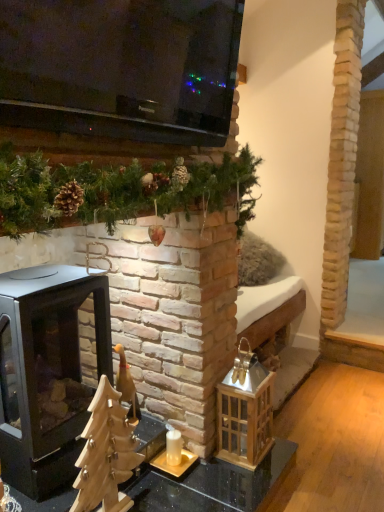
Question: Should I look upward or downward to see gold metallic candle holder at center?

Choices:
 (A) up
 (B) down

Answer: (B)

Question: Can you confirm if gold metallic candle holder at center is shorter than black matte wood burning stove at left?

Choices:
 (A) yes
 (B) no

Answer: (A)

Question: From a real-world perspective, is gold metallic candle holder at center positioned under black matte wood burning stove at left based on gravity?

Choices:
 (A) no
 (B) yes

Answer: (B)

Question: From the image's perspective, is gold metallic candle holder at center on top of black matte wood burning stove at left?

Choices:
 (A) no
 (B) yes

Answer: (A)

Question: Does gold metallic candle holder at center appear on the right side of black matte wood burning stove at left?

Choices:
 (A) yes
 (B) no

Answer: (A)

Question: Is gold metallic candle holder at center positioned in front of black matte wood burning stove at left?

Choices:
 (A) yes
 (B) no

Answer: (B)

Question: From a real-world perspective, is gold metallic candle holder at center physically above black matte wood burning stove at left?

Choices:
 (A) yes
 (B) no

Answer: (B)

Question: Would you say black matte wood burning stove at left contains gold metallic candle holder at center?

Choices:
 (A) yes
 (B) no

Answer: (B)

Question: Can you confirm if black matte wood burning stove at left is smaller than gold metallic candle holder at center?

Choices:
 (A) no
 (B) yes

Answer: (A)

Question: Does black matte wood burning stove at left have a greater height compared to gold metallic candle holder at center?

Choices:
 (A) yes
 (B) no

Answer: (A)

Question: Does black matte wood burning stove at left appear on the right side of gold metallic candle holder at center?

Choices:
 (A) yes
 (B) no

Answer: (B)

Question: From the image's perspective, would you say black matte wood burning stove at left is shown under gold metallic candle holder at center?

Choices:
 (A) yes
 (B) no

Answer: (B)

Question: Can you confirm if black matte wood burning stove at left is bigger than gold metallic candle holder at center?

Choices:
 (A) no
 (B) yes

Answer: (B)

Question: Considering the positions of gold metallic candle holder at center and black matte wood burning stove at left in the image, is gold metallic candle holder at center bigger or smaller than black matte wood burning stove at left?

Choices:
 (A) big
 (B) small

Answer: (B)